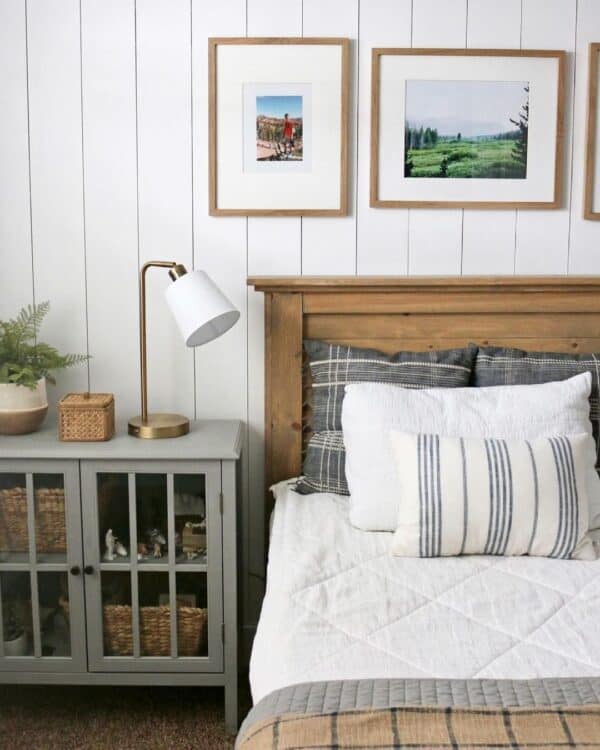
Image resolution: width=600 pixels, height=750 pixels. Find the location of `pillow`. pillow is located at coordinates (520, 504), (509, 420), (519, 364), (407, 368).